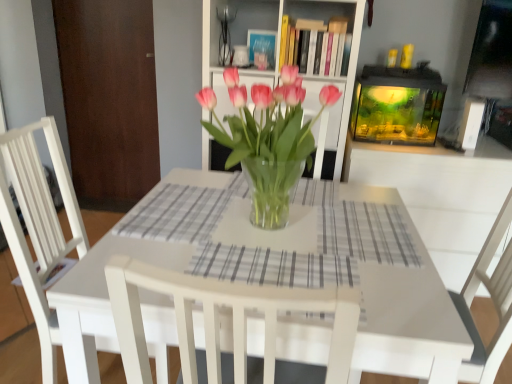
The image size is (512, 384). Find the location of `vacant space situated above gray checkered placemat at center, acting as the 1th plaid starting from the front (from a real-world perspective)`. vacant space situated above gray checkered placemat at center, acting as the 1th plaid starting from the front (from a real-world perspective) is located at coordinates (280, 263).